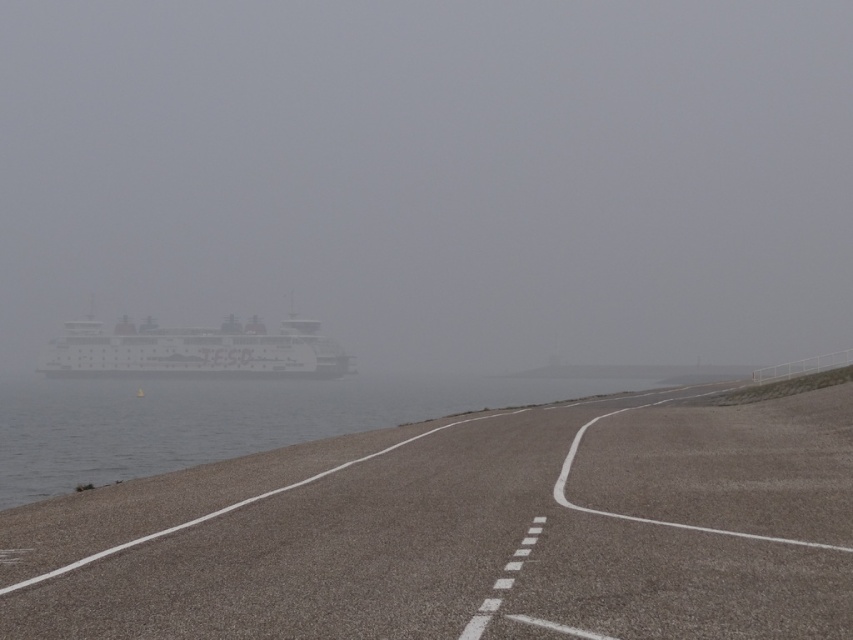
You are standing on the curved road in the foreground of the coastal scene. You see the clear water at left and the white matte ship at left. How far apart are these two objects from each other?

The clear water at left is 16.41 meters away from the white matte ship at left.

You are a photographer trying to capture the entire view of the foggy white ship at center and the clear water at left in one shot. Given that your camera has a fixed focal length, which object should you prioritize framing closer to the center of the photo to ensure both are visible?

The foggy white ship at center is wider than the clear water at left, so to ensure both are visible in the photo, you should prioritize framing the foggy white ship at center closer to the center of the photo.

Consider the image. You are a sailor navigating a small boat near the coast. You see the clear water at left and the white matte ship at left in the foggy scene. Which direction should you steer your boat to stay in the navigable channel?

The clear water at left is wider than the white matte ship at left, so steering towards the clear water at left would keep you in the navigable channel.